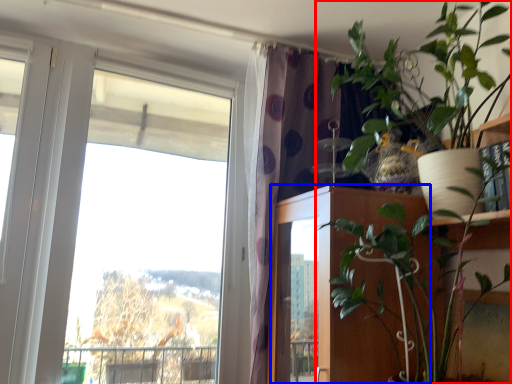
Question: Which object is closer to the camera taking this photo, houseplant (highlighted by a red box) or door (highlighted by a blue box)?

Choices:
 (A) houseplant
 (B) door

Answer: (A)